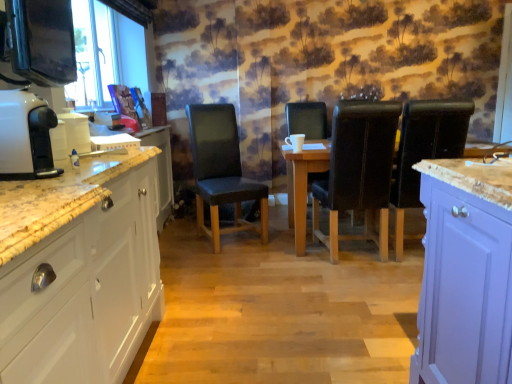
The width and height of the screenshot is (512, 384). In order to click on free space to the left of leather at center, which is counted as the second chair, starting from the right in this screenshot , I will do `click(289, 266)`.